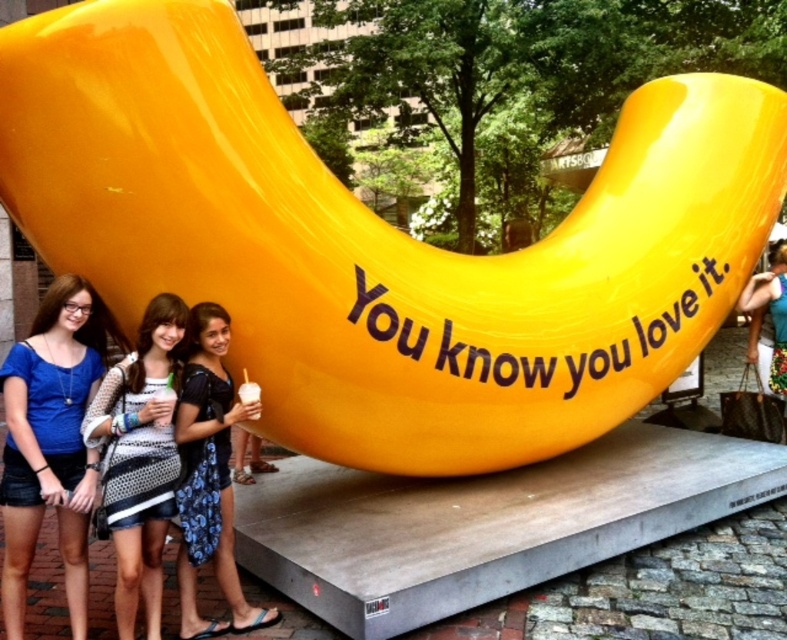
From the picture: Is matte blue shirt at center smaller than white dotted dress at center?

No, matte blue shirt at center is not smaller than white dotted dress at center.

Does point (17, 500) come in front of point (167, 472)?

That is True.

I want to click on matte blue shirt at center, so click(x=50, y=442).

Can you confirm if matte blue shirt at center is smaller than printed fabric purse at right?

Yes, matte blue shirt at center is smaller than printed fabric purse at right.

Is matte blue shirt at center positioned in front of printed fabric purse at right?

That is True.

Between point (41, 492) and point (780, 390), which one is positioned behind?

Positioned behind is point (780, 390).

Locate an element on the screen. The height and width of the screenshot is (640, 787). matte blue shirt at center is located at coordinates (50, 442).

Image resolution: width=787 pixels, height=640 pixels. Identify the location of matte black dress at center. (209, 470).

Does matte black dress at center come behind printed fabric purse at right?

No, it is in front of printed fabric purse at right.

Is point (224, 477) closer to camera compared to point (778, 285)?

Yes, it is in front of point (778, 285).

You are a GUI agent. You are given a task and a screenshot of the screen. Output one action in this format:
    pyautogui.click(x=<x>, y=<y>)
    Task: Click on the matte black dress at center
    
    Given the screenshot: What is the action you would take?
    pyautogui.click(x=209, y=470)